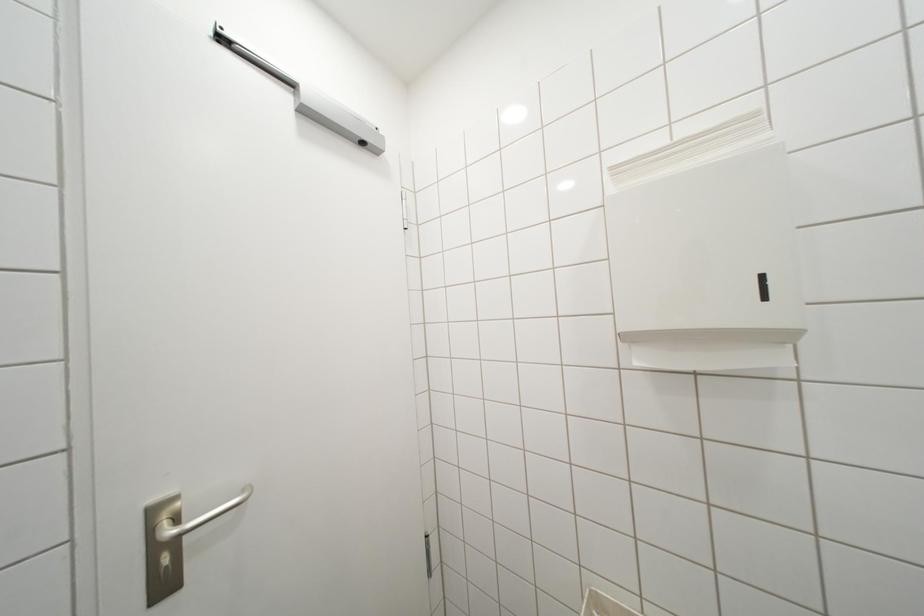
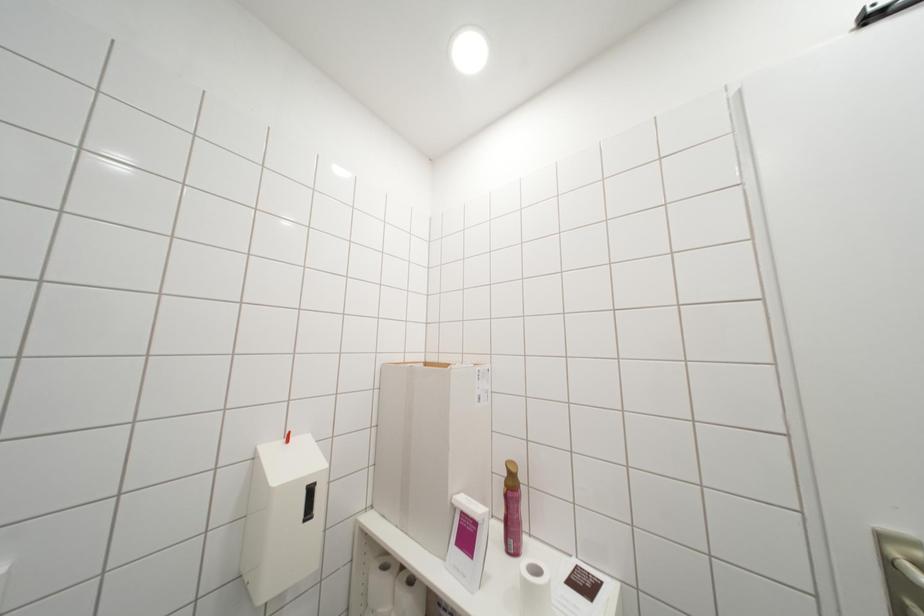
Question: The camera is either moving clockwise (left) or counter-clockwise (right) around the object. The first image is from the beginning of the video and the second image is from the end. Is the camera moving left or right when shooting the video?

Choices:
 (A) Left
 (B) Right

Answer: (B)